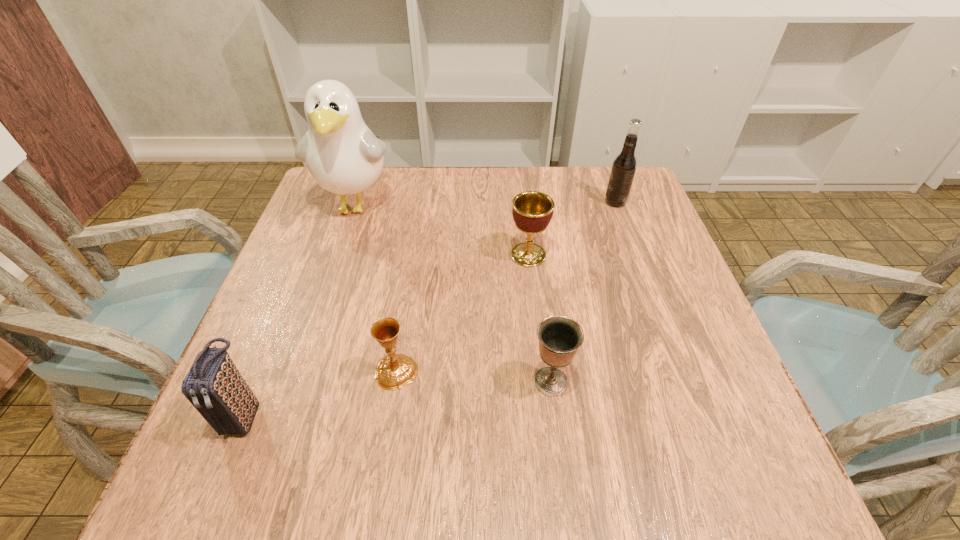
Locate an element on the screen. This screenshot has height=540, width=960. gull is located at coordinates (343, 156).

You are a GUI agent. You are given a task and a screenshot of the screen. Output one action in this format:
    pyautogui.click(x=<x>, y=<y>)
    Task: Click on the rightmost object
    This screenshot has width=960, height=540.
    Given the screenshot: What is the action you would take?
    624,166

You are a GUI agent. You are given a task and a screenshot of the screen. Output one action in this format:
    pyautogui.click(x=<x>, y=<y>)
    Task: Click on the root beer
    
    Given the screenshot: What is the action you would take?
    pyautogui.click(x=624, y=166)

This screenshot has height=540, width=960. In order to click on clutch bag in this screenshot , I will do `click(214, 386)`.

Locate an element on the screen. The width and height of the screenshot is (960, 540). the farthest chalice is located at coordinates (532, 211).

At what (x,y) coordinates should I click in order to perform the action: click on the leftmost chalice. Please return your answer as a coordinate pair (x, y). Looking at the image, I should click on (395, 371).

What are the coordinates of `vacant position located 0.070m on the beak of the tallest object` in the screenshot? It's located at (339, 258).

Where is `vacant area situated on the label of the fifth shortest object`? The height and width of the screenshot is (540, 960). vacant area situated on the label of the fifth shortest object is located at coordinates (460, 202).

Locate an element on the screen. Image resolution: width=960 pixels, height=540 pixels. free spot located on the label of the fifth shortest object is located at coordinates (506, 202).

Find the location of `vacant space located 0.300m on the label of the fifth shortest object`. vacant space located 0.300m on the label of the fifth shortest object is located at coordinates (491, 202).